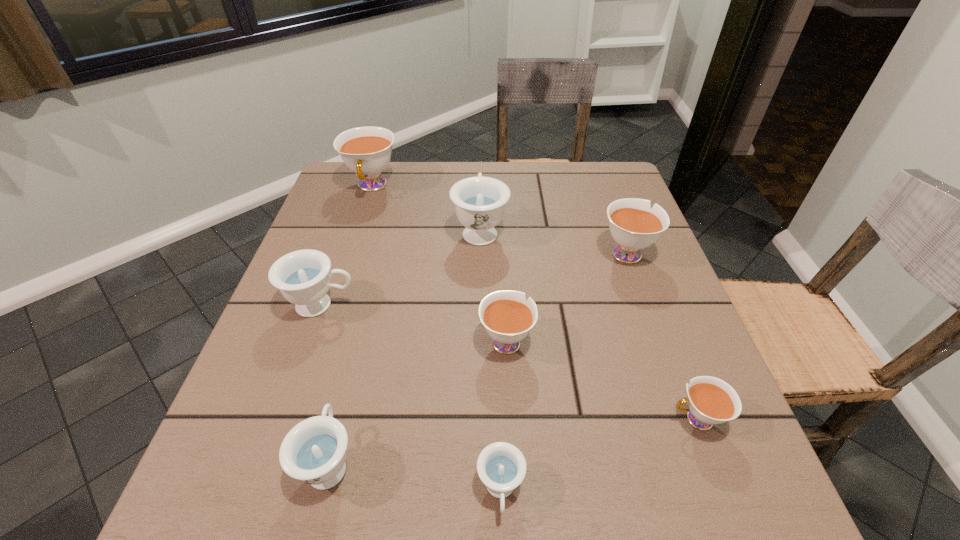
I want to click on free space located 0.300m on the side of the biggest white teacup with the handle, so click(340, 285).

Where is `free space located on the side of the biggest blue teacup with the handle`? free space located on the side of the biggest blue teacup with the handle is located at coordinates (480, 174).

In order to click on blank area located on the side of the biggest blue teacup with the handle in this screenshot , I will do `click(480, 198)`.

Locate an element on the screen. Image resolution: width=960 pixels, height=540 pixels. vacant area located 0.120m on the side of the biggest blue teacup with the handle is located at coordinates (480, 184).

The image size is (960, 540). In order to click on free location located on the side of the second farthest white teacup with the handle in this screenshot , I will do point(593,163).

Locate an element on the screen. vacant space positioned 0.290m on the side of the second farthest white teacup with the handle is located at coordinates (596, 170).

At what (x,y) coordinates should I click in order to perform the action: click on vacant space located on the side of the second farthest white teacup with the handle. Please return your answer as a coordinate pair (x, y). Looking at the image, I should click on (602, 187).

The height and width of the screenshot is (540, 960). What are the coordinates of `vacant space located on the side of the third nearest blue teacup with the handle` in the screenshot? It's located at (548, 305).

Image resolution: width=960 pixels, height=540 pixels. I want to click on vacant area located on the side of the third farthest white teacup with the handle, so click(x=501, y=246).

Find the location of a particular element. Image resolution: width=960 pixels, height=540 pixels. blank space located 0.390m on the side of the third farthest white teacup with the handle is located at coordinates (499, 204).